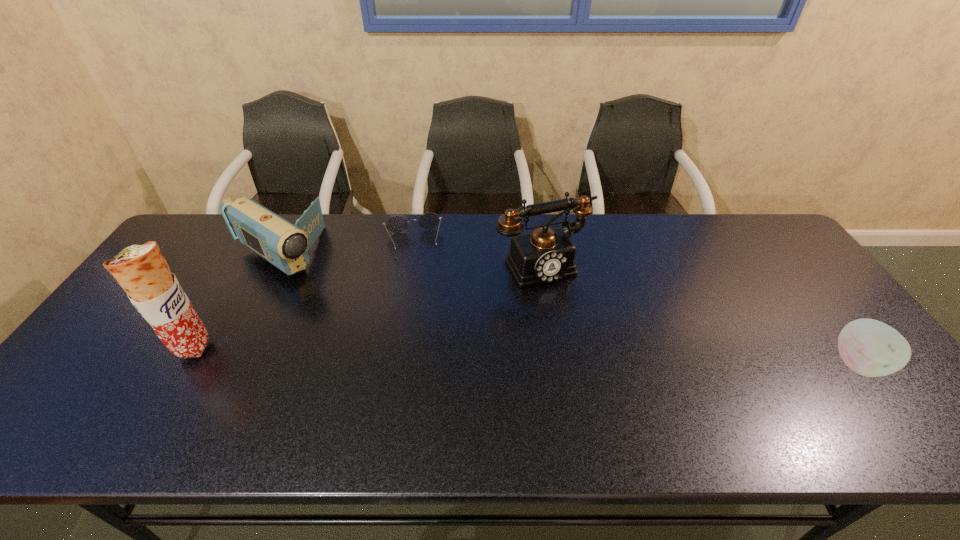
Identify the location of vacant space located on the front-facing side of the shortest object. This screenshot has height=540, width=960. (419, 302).

Identify the location of vacant space positioned on the front-facing side of the shortest object. (419, 302).

I want to click on free region located 0.400m on the front-facing side of the shortest object, so click(x=425, y=362).

Locate an element on the screen. This screenshot has width=960, height=540. vacant region located on the front of the second object from right to left at the rotary dial is located at coordinates (575, 312).

At what (x,y) coordinates should I click in order to perform the action: click on vacant point located on the front of the second object from right to left at the rotary dial. Please return your answer as a coordinate pair (x, y). Looking at the image, I should click on (599, 350).

What are the coordinates of `vacant region located 0.190m on the front of the second object from right to left at the rotary dial` in the screenshot? It's located at (590, 336).

At what (x,y) coordinates should I click in order to perform the action: click on vacant space situated on the side of the camcorder with the flip-out screen. Please return your answer as a coordinate pair (x, y). This screenshot has width=960, height=540. Looking at the image, I should click on (352, 304).

You are a GUI agent. You are given a task and a screenshot of the screen. Output one action in this format:
    pyautogui.click(x=<x>, y=<y>)
    Task: Click on the free space located 0.060m on the side of the camcorder with the flip-out screen
    
    Given the screenshot: What is the action you would take?
    pyautogui.click(x=321, y=283)

Where is `vacant space located 0.330m on the side of the camcorder with the flip-out screen`? This screenshot has height=540, width=960. vacant space located 0.330m on the side of the camcorder with the flip-out screen is located at coordinates (385, 326).

Find the location of a particular element. spectacles present at the far edge is located at coordinates (397, 224).